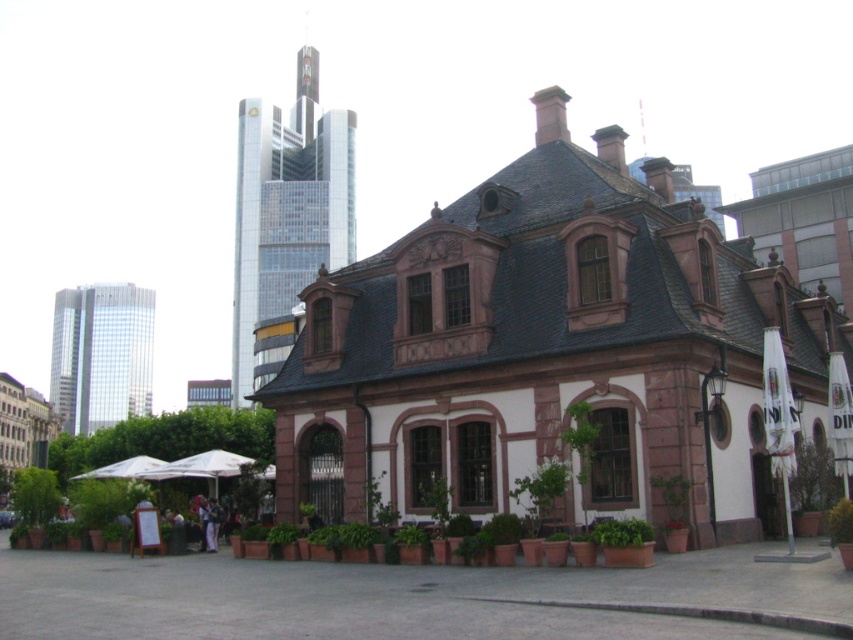
You are standing in a city square and want to take a photo of the pink stone building at center. If your camera can focus on objects up to 30 meters away, will you need to move closer to capture a clear image?

The pink stone building at center is 34.74 meters away from you, which is beyond the camera focus range of 30 meters. Therefore, you need to move closer to ensure the building is in focus.

You are standing in the city square looking at the historic building. There are two points marked on the building facade. One is at coordinates point (370,419) and the other at point (776,380). Which point is closer to you?

Point (370,419) is closer to you because it is further to the viewer than point (776,380).

You are standing at the entrance of the pink stone building at center. If you walk straight ahead, will you eventually reach the city square? Please explain your reasoning based on the scene description.

The scene description mentions the building is situated in a city square. Therefore, walking straight ahead from the entrance of the pink stone building at center would lead you into the city square itself.